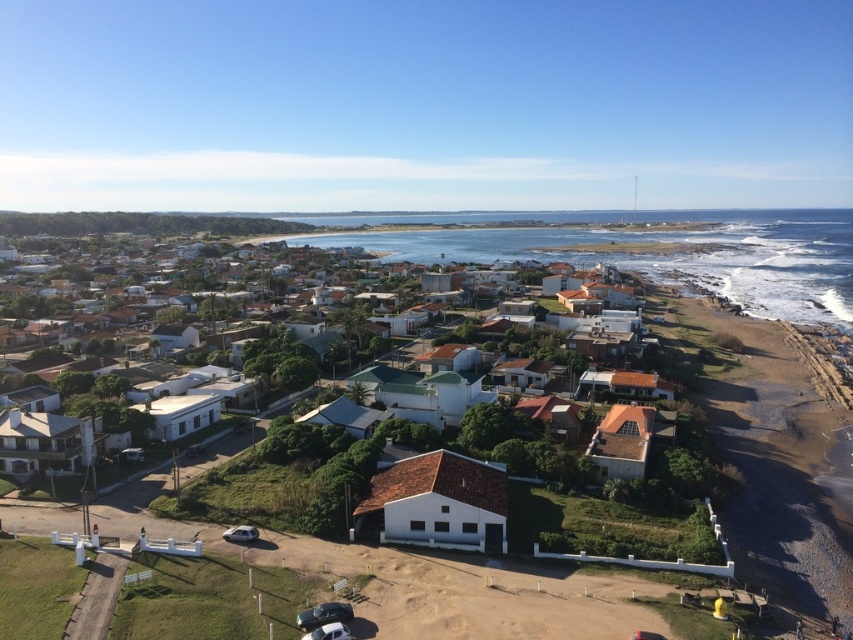
Between point (422, 445) and point (433, 216), which one is positioned behind?

The point (433, 216) is more distant.

Who is positioned more to the left, white matte house at center or blue water at center?

From the viewer's perspective, white matte house at center appears more on the left side.

What are the coordinates of `white matte house at center` in the screenshot? It's located at (410, 440).

Identify the location of white matte house at center. (410, 440).